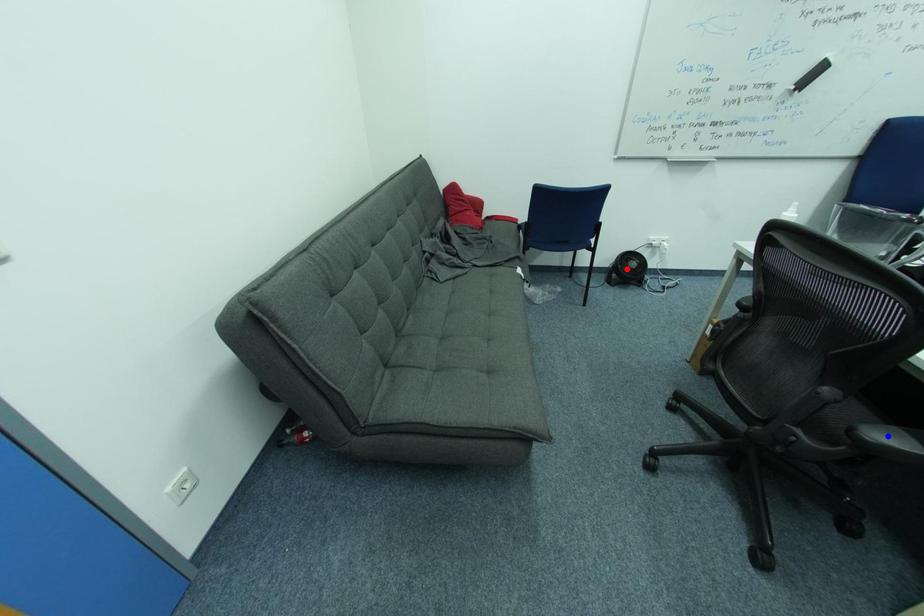
Question: Two points are marked on the image. Which point is closer to the camera?

Choices:
 (A) Blue point is closer.
 (B) Red point is closer.

Answer: (A)